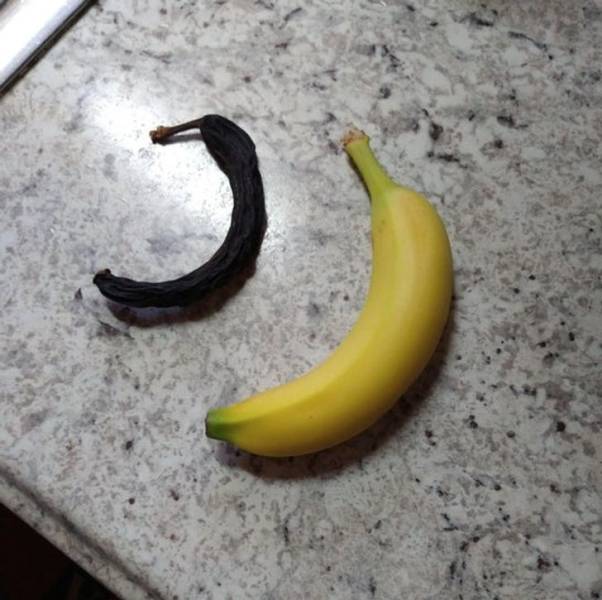
The height and width of the screenshot is (600, 602). In order to click on marbled countertop in this screenshot , I will do `click(556, 542)`.